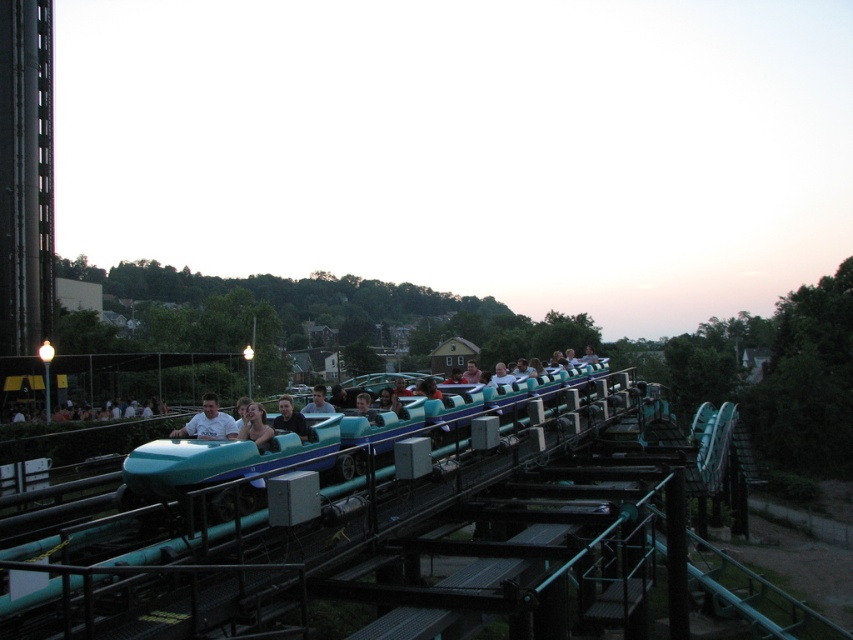
Between teal glossy roller coaster rail at center and light blue plastic helmet at center, which one has less height?

Standing shorter between the two is light blue plastic helmet at center.

Is teal glossy roller coaster rail at center taller than light blue plastic helmet at center?

Yes, teal glossy roller coaster rail at center is taller than light blue plastic helmet at center.

What do you see at coordinates (373, 525) in the screenshot?
I see `teal glossy roller coaster rail at center` at bounding box center [373, 525].

You are a GUI agent. You are given a task and a screenshot of the screen. Output one action in this format:
    pyautogui.click(x=<x>, y=<y>)
    Task: Click on the teal glossy roller coaster rail at center
    Image resolution: width=853 pixels, height=640 pixels.
    Given the screenshot: What is the action you would take?
    pyautogui.click(x=373, y=525)

Is matte blue helmet at center closer to the viewer compared to matte blue shirt at center?

Yes, matte blue helmet at center is in front of matte blue shirt at center.

Between matte blue helmet at center and matte blue shirt at center, which one is positioned lower?

matte blue shirt at center is below.

Is point (254, 412) positioned before point (273, 422)?

Yes, point (254, 412) is closer to viewer.

At what (x,y) coordinates should I click in order to perform the action: click on matte blue helmet at center. Please return your answer as a coordinate pair (x, y). Looking at the image, I should click on (254, 426).

Is point (138, 476) closer to camera compared to point (218, 420)?

Yes.

Between point (427, 422) and point (224, 422), which one is positioned in front?

Point (224, 422)

Locate an element on the screen. teal glossy roller coaster car at center is located at coordinates (325, 440).